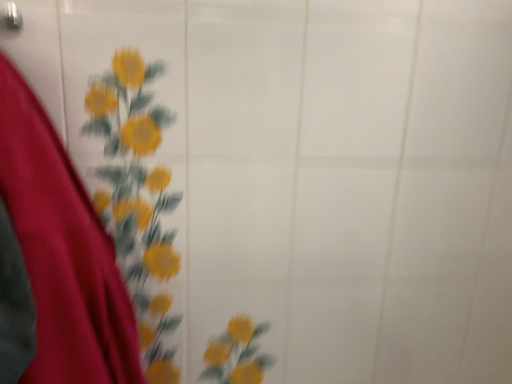
Question: From a real-world perspective, relative to metallic silver door handle at upper left, is velvet red dress at left vertically above or below?

Choices:
 (A) above
 (B) below

Answer: (B)

Question: Is velvet red dress at left in front of or behind metallic silver door handle at upper left in the image?

Choices:
 (A) behind
 (B) front

Answer: (B)

Question: From the image's perspective, is velvet red dress at left positioned above or below metallic silver door handle at upper left?

Choices:
 (A) below
 (B) above

Answer: (A)

Question: Relative to velvet red dress at left, is metallic silver door handle at upper left in front or behind?

Choices:
 (A) behind
 (B) front

Answer: (A)

Question: Based on their sizes in the image, would you say metallic silver door handle at upper left is bigger or smaller than velvet red dress at left?

Choices:
 (A) small
 (B) big

Answer: (A)

Question: Is metallic silver door handle at upper left to the left or to the right of velvet red dress at left in the image?

Choices:
 (A) right
 (B) left

Answer: (B)

Question: Considering the positions of metallic silver door handle at upper left and velvet red dress at left in the image, is metallic silver door handle at upper left wider or thinner than velvet red dress at left?

Choices:
 (A) thin
 (B) wide

Answer: (A)